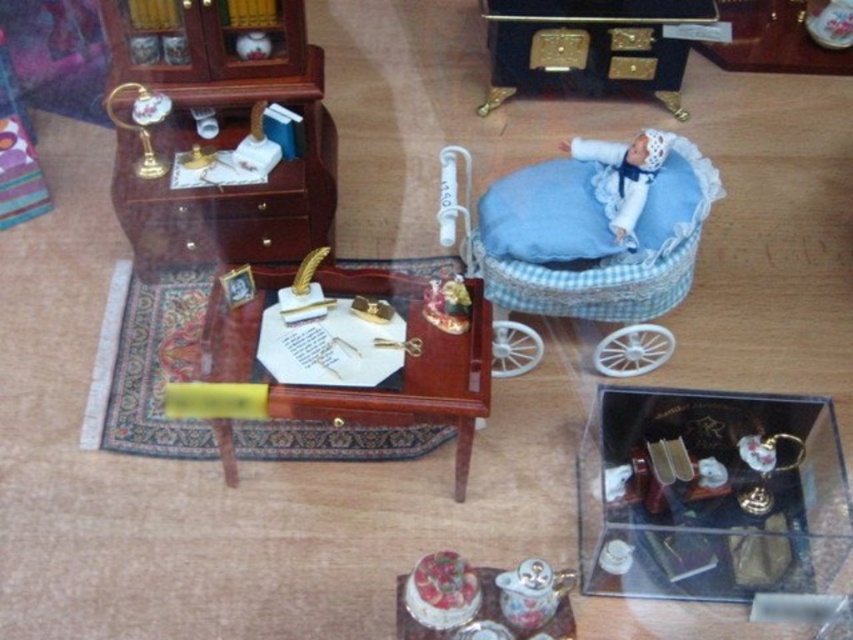
Can you confirm if blue checkered fabric baby carriage at upper right is positioned to the right of wooden desk at center?

Yes, blue checkered fabric baby carriage at upper right is to the right of wooden desk at center.

Does blue checkered fabric baby carriage at upper right come behind wooden desk at center?

Yes, blue checkered fabric baby carriage at upper right is behind wooden desk at center.

This screenshot has height=640, width=853. In order to click on blue checkered fabric baby carriage at upper right in this screenshot , I will do `click(595, 246)`.

Between smooth porcelain cake at center and porcelain teacup at lower center, which one is positioned lower?

porcelain teacup at lower center is below.

Image resolution: width=853 pixels, height=640 pixels. What do you see at coordinates (440, 592) in the screenshot?
I see `smooth porcelain cake at center` at bounding box center [440, 592].

Identify the location of smooth porcelain cake at center. This screenshot has width=853, height=640. (440, 592).

Identify the location of smooth porcelain cake at center. point(440,592).

Does clear plastic box at center appear under blue checkered fabric baby carriage at upper right?

Indeed, clear plastic box at center is positioned under blue checkered fabric baby carriage at upper right.

Between point (651, 579) and point (495, 339), which one is positioned behind?

The point (495, 339) is behind.

Does point (659, 404) lie behind point (635, 196)?

No.

You are a GUI agent. You are given a task and a screenshot of the screen. Output one action in this format:
    pyautogui.click(x=<x>, y=<y>)
    Task: Click on the clear plastic box at center
    
    Given the screenshot: What is the action you would take?
    (x=708, y=496)